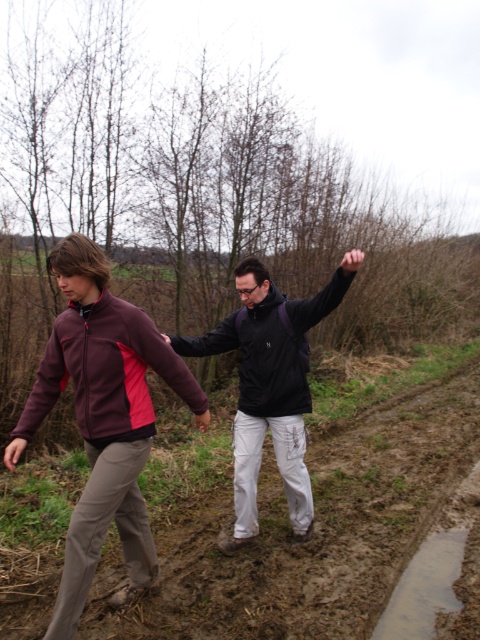
Which is in front, point (396, 516) or point (299, 342)?

Point (299, 342) is in front.

Is muddy ground at lower center smaller than matte black jacket at center?

Yes.

Between point (156, 596) and point (252, 529), which one is positioned in front?

Point (156, 596)

Where is `muddy ground at lower center`? This screenshot has height=640, width=480. muddy ground at lower center is located at coordinates (288, 525).

Based on the photo, is maroon fleece jacket at left smaller than matte black jacket at center?

Indeed, maroon fleece jacket at left has a smaller size compared to matte black jacket at center.

Is maroon fleece jacket at left shorter than matte black jacket at center?

Incorrect, maroon fleece jacket at left's height does not fall short of matte black jacket at center's.

I want to click on maroon fleece jacket at left, so click(x=103, y=417).

The height and width of the screenshot is (640, 480). I want to click on maroon fleece jacket at left, so click(103, 417).

Can you confirm if muddy ground at lower center is positioned to the right of maroon fleece jacket at left?

Correct, you'll find muddy ground at lower center to the right of maroon fleece jacket at left.

Does muddy ground at lower center have a greater width compared to maroon fleece jacket at left?

Yes, muddy ground at lower center is wider than maroon fleece jacket at left.

Is point (146, 624) farther from viewer compared to point (96, 433)?

Yes, it is behind point (96, 433).

Where is `muddy ground at lower center`? This screenshot has height=640, width=480. muddy ground at lower center is located at coordinates (288, 525).